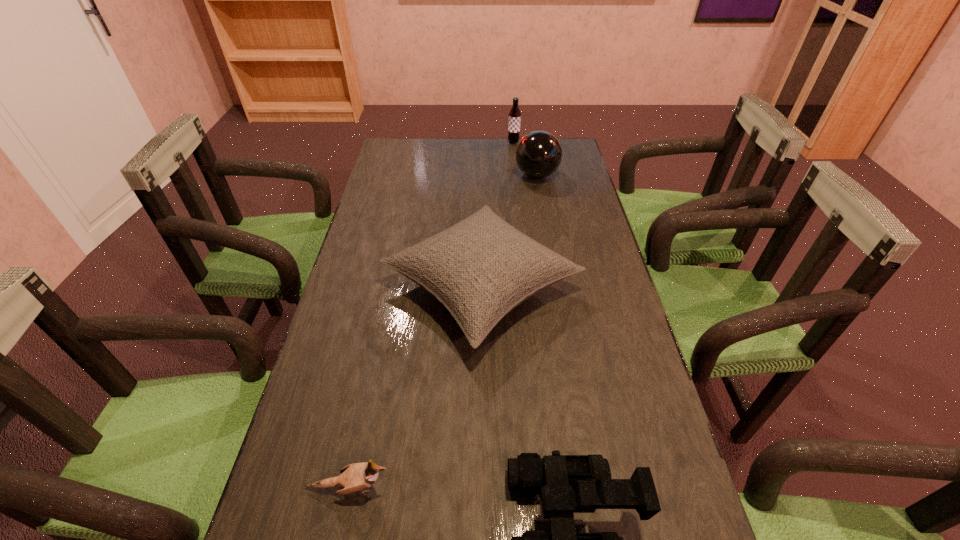
In the image, there is a desktop. At what (x,y) coordinates should I click in order to perform the action: click on vacant space at the far left corner. Please return your answer as a coordinate pair (x, y). The width and height of the screenshot is (960, 540). Looking at the image, I should click on (419, 139).

Locate an element on the screen. The image size is (960, 540). vacant space that's between the second farthest object and the bird is located at coordinates (443, 332).

This screenshot has width=960, height=540. I want to click on blank region between the cushion and the root beer, so click(497, 214).

Identify the location of vacant area that lies between the cushion and the root beer. pos(497,214).

Where is `object that stands as the third closest to the binoculars`? object that stands as the third closest to the binoculars is located at coordinates (538, 154).

Locate which object ranks second in proximity to the bowling ball. Please provide its 2D coordinates. Your answer should be formatted as a tuple, i.e. [(x, y)], where the tuple contains the x and y coordinates of a point satisfying the conditions above.

[(481, 268)]

Identify the location of free spot that satisfies the following two spatial constraints: 1. on the front side of the root beer; 2. at the face of the shortest object. This screenshot has width=960, height=540. (553, 488).